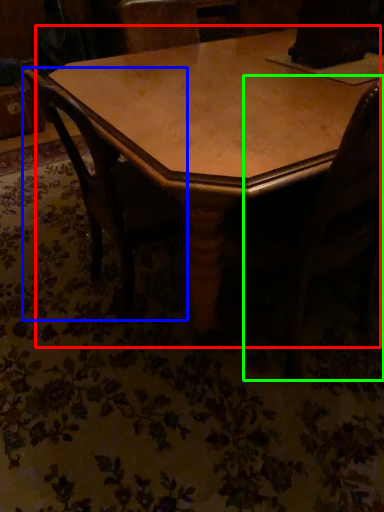
Question: Which object is positioned farthest from table (highlighted by a red box)? Select from chair (highlighted by a blue box) and swivel chair (highlighted by a green box).

Choices:
 (A) chair
 (B) swivel chair

Answer: (B)